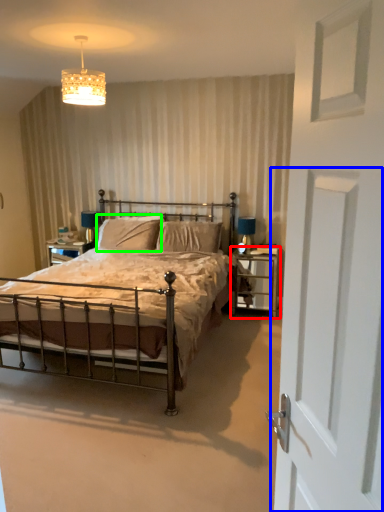
Question: Which is nearer to the nightstand (highlighted by a red box)? screen door (highlighted by a blue box) or pillow (highlighted by a green box).

Choices:
 (A) screen door
 (B) pillow

Answer: (B)